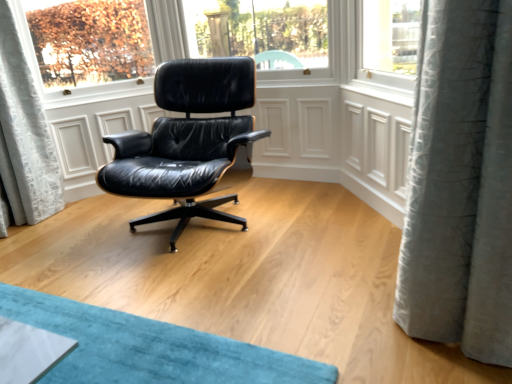
Question: Is point (137, 162) closer or farther from the camera than point (465, 59)?

Choices:
 (A) farther
 (B) closer

Answer: (A)

Question: From a real-world perspective, is black leather chair at center above or below gray textured curtain at right?

Choices:
 (A) below
 (B) above

Answer: (A)

Question: From the image's perspective, is black leather chair at center positioned above or below gray textured curtain at right?

Choices:
 (A) below
 (B) above

Answer: (B)

Question: Is gray textured curtain at right wider or thinner than black leather chair at center?

Choices:
 (A) wide
 (B) thin

Answer: (B)

Question: Is gray textured curtain at right in front of or behind black leather chair at center in the image?

Choices:
 (A) front
 (B) behind

Answer: (A)

Question: Which is correct: gray textured curtain at right is inside black leather chair at center, or outside of it?

Choices:
 (A) outside
 (B) inside

Answer: (A)

Question: Considering the positions of gray textured curtain at right and black leather chair at center in the image, is gray textured curtain at right taller or shorter than black leather chair at center?

Choices:
 (A) tall
 (B) short

Answer: (A)